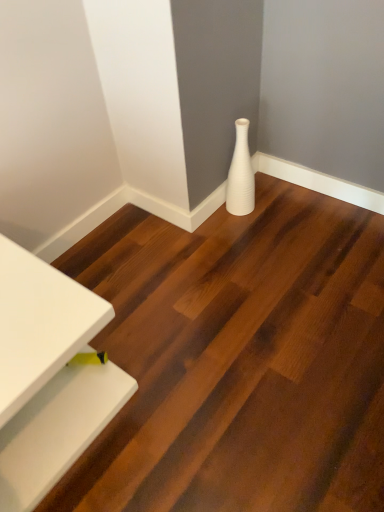
Identify the location of vacant area that is in front of white ribbed vase at lower right. (249, 234).